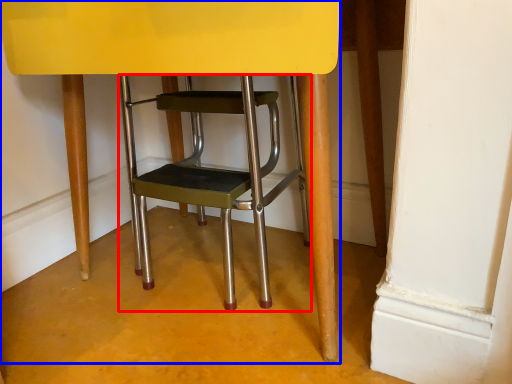
Question: Among these objects, which one is nearest to the camera, stool (highlighted by a red box) or chair (highlighted by a blue box)?

Choices:
 (A) stool
 (B) chair

Answer: (B)